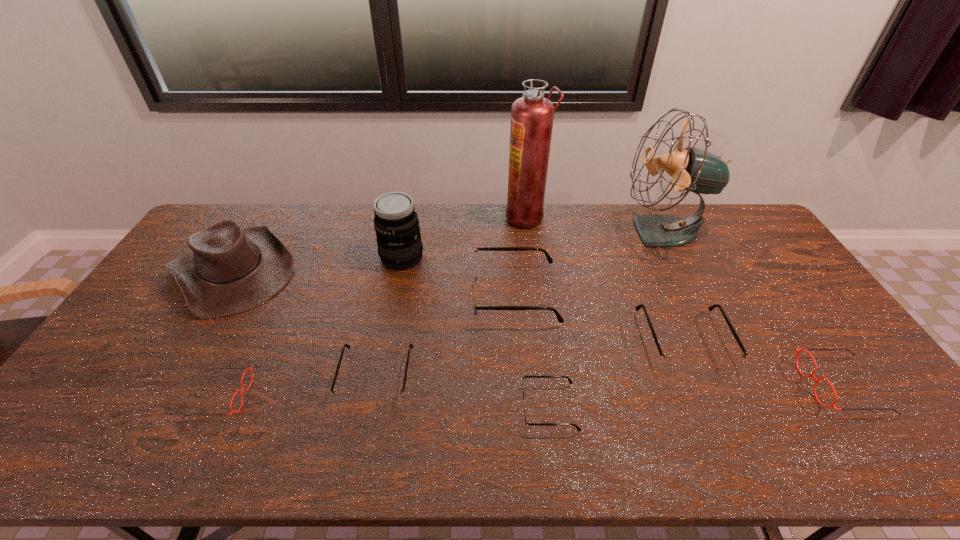
I want to click on object present at the right edge, so click(833, 405).

Locate an element on the screen. This screenshot has height=540, width=960. object that is at the far left corner is located at coordinates (227, 269).

You are a GUI agent. You are given a task and a screenshot of the screen. Output one action in this format:
    pyautogui.click(x=<x>, y=<y>)
    Task: Click on the blank area at the far edge
    This screenshot has width=960, height=540.
    Given the screenshot: What is the action you would take?
    pyautogui.click(x=623, y=242)

In order to click on blank space at the right edge of the desktop in this screenshot , I will do `click(777, 274)`.

The height and width of the screenshot is (540, 960). In the image, there is a desktop. Find the location of `vacant space at the far right corner`. vacant space at the far right corner is located at coordinates (748, 219).

Locate an element on the screen. The width and height of the screenshot is (960, 540). vacant area at the near right corner is located at coordinates (858, 427).

Where is `unoccupied position between the blue fan and the second biggest black spectacles`? The width and height of the screenshot is (960, 540). unoccupied position between the blue fan and the second biggest black spectacles is located at coordinates click(x=673, y=286).

This screenshot has width=960, height=540. Identify the location of empty location between the right red spectacles and the red fire extinguisher. (684, 301).

Where is `free space between the red fire extinguisher and the rightmost object`? Image resolution: width=960 pixels, height=540 pixels. free space between the red fire extinguisher and the rightmost object is located at coordinates (684, 301).

You are a GUI agent. You are given a task and a screenshot of the screen. Output one action in this format:
    pyautogui.click(x=<x>, y=<y>)
    Task: Click on the vacant area that lies between the right red spectacles and the leftmost spectacles
    The image size is (960, 540).
    Given the screenshot: What is the action you would take?
    pyautogui.click(x=531, y=391)